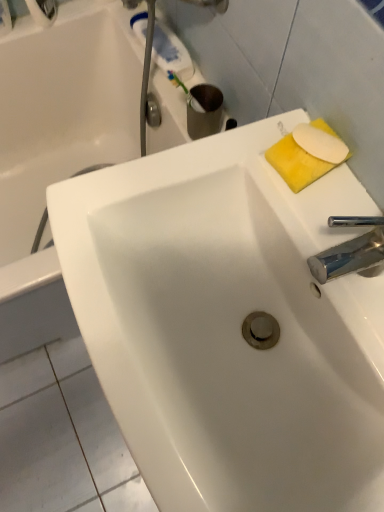
Identify the location of space that is in front of yellow sponge at upper right, which ranks as the second soap in front-to-back order. (319, 229).